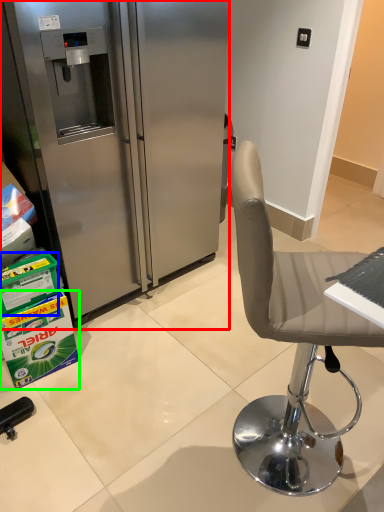
Question: Which is farther away from refrigerator (highlighted by a red box)? box (highlighted by a blue box) or box (highlighted by a green box)?

Choices:
 (A) box
 (B) box

Answer: (A)